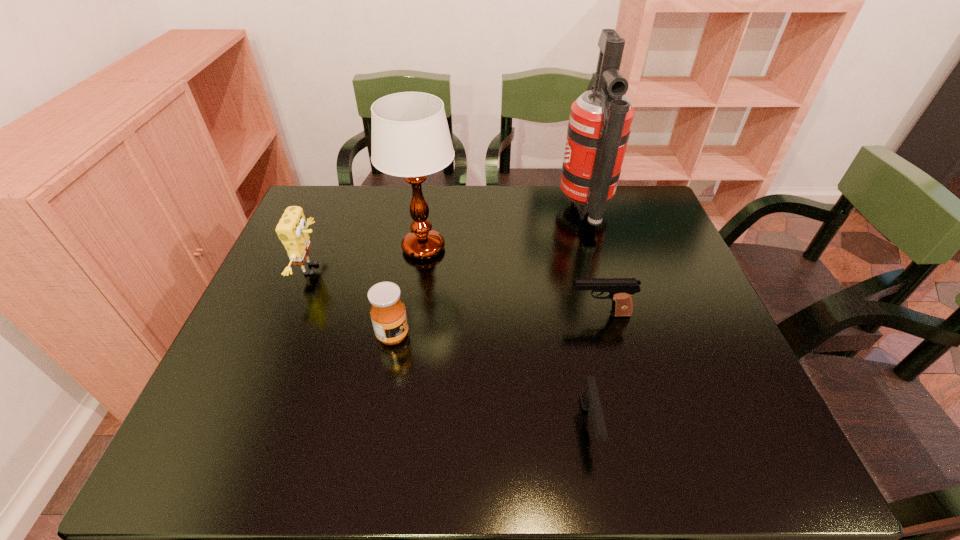
Find the location of `free space located 0.390m on the front label side of the tallest object`. free space located 0.390m on the front label side of the tallest object is located at coordinates (436, 210).

Find the location of `vacant space situated 0.320m on the front label side of the tallest object`. vacant space situated 0.320m on the front label side of the tallest object is located at coordinates (458, 210).

Where is `free spot located 0.260m on the front label side of the tallest object`? This screenshot has width=960, height=540. free spot located 0.260m on the front label side of the tallest object is located at coordinates tap(476, 210).

This screenshot has height=540, width=960. In order to click on vacant space located on the back of the fifth shortest object in this screenshot , I will do `click(429, 209)`.

Identify the location of vacant space located 0.350m on the face of the leftmost object. This screenshot has height=540, width=960. (453, 269).

Locate an element on the screen. vacant position located on the front-facing side of the fourth tallest object is located at coordinates (473, 335).

Where is `free spot located 0.320m at the barrel of the fifth tallest object`? This screenshot has height=540, width=960. free spot located 0.320m at the barrel of the fifth tallest object is located at coordinates (438, 314).

You are a GUI agent. You are given a task and a screenshot of the screen. Output one action in this format:
    pyautogui.click(x=<x>, y=<y>)
    Task: Click on the free space located 0.130m at the barrel of the fifth tallest object
    
    Given the screenshot: What is the action you would take?
    pyautogui.click(x=515, y=314)

The height and width of the screenshot is (540, 960). I want to click on free space located at the barrel of the fifth tallest object, so click(x=446, y=314).

This screenshot has width=960, height=540. Find the location of `fire extinguisher that is at the far edge`. fire extinguisher that is at the far edge is located at coordinates (600, 121).